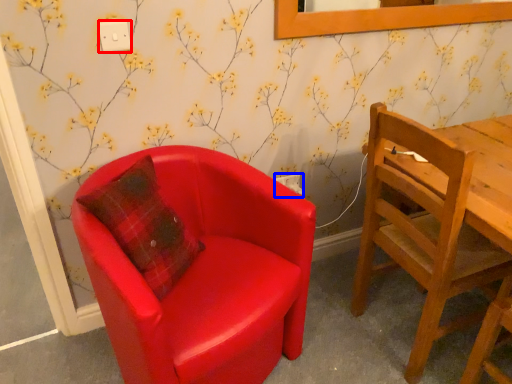
Question: Which object appears farthest to the camera in this image, power outlet (highlighted by a red box) or power outlet (highlighted by a blue box)?

Choices:
 (A) power outlet
 (B) power outlet

Answer: (B)